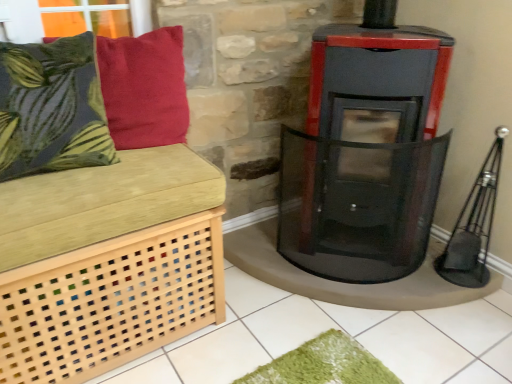
I want to click on free point above light wood lattice bench at left (from a real-world perspective), so click(x=101, y=175).